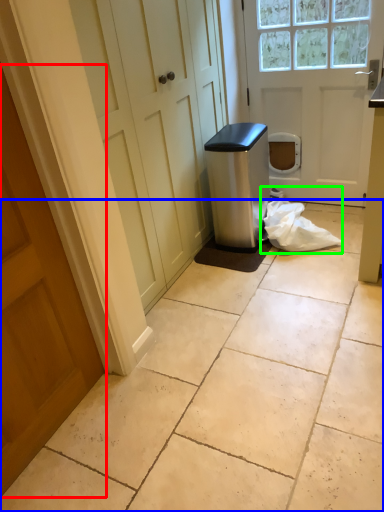
Question: Which object is positioned closest to door (highlighted by a red box)? Select from concrete (highlighted by a blue box) and material (highlighted by a green box).

Choices:
 (A) concrete
 (B) material

Answer: (A)